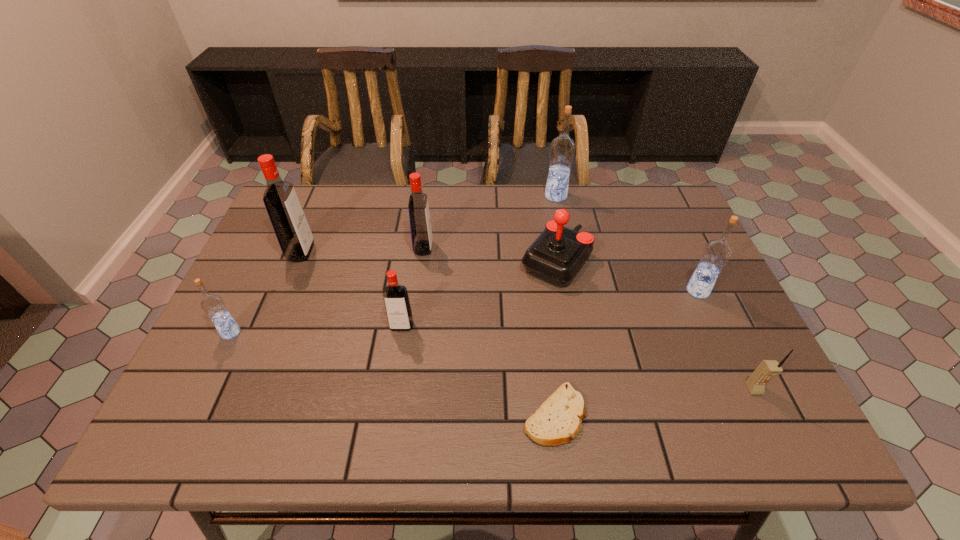
The image size is (960, 540). Identify the location of the fifth vodka from left to right. point(562,148).

Locate an element on the screen. This screenshot has height=540, width=960. the farthest blue vodka is located at coordinates (562, 148).

At what (x,y) coordinates should I click in order to perform the action: click on the biggest red vodka. Please return your answer as a coordinate pair (x, y). Looking at the image, I should click on (290, 225).

The width and height of the screenshot is (960, 540). I want to click on the fifth vodka from right to left, so click(290, 225).

Where is `the second smallest red vodka`? Image resolution: width=960 pixels, height=540 pixels. the second smallest red vodka is located at coordinates (420, 224).

This screenshot has width=960, height=540. I want to click on the rightmost blue vodka, so click(716, 253).

I want to click on the second smallest blue vodka, so click(716, 253).

The width and height of the screenshot is (960, 540). I want to click on joystick, so click(558, 253).

The height and width of the screenshot is (540, 960). I want to click on the smallest red vodka, so click(398, 309).

At what (x,y) coordinates should I click in order to perform the action: click on the leftmost blue vodka. Please return your answer as a coordinate pair (x, y). Looking at the image, I should click on (213, 305).